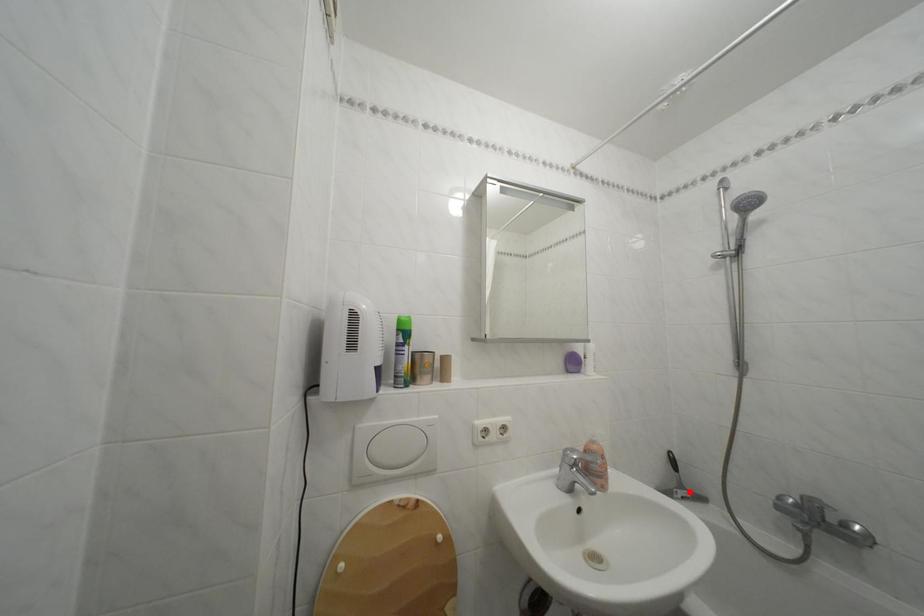
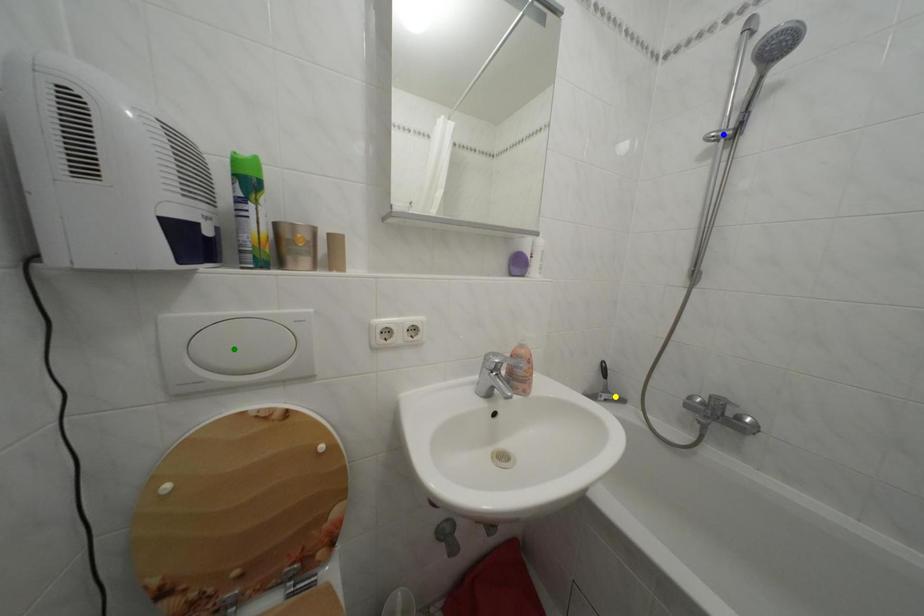
Question: I am providing you with two images of the same scene from different viewpoints. A red point is marked on the first image. You are given multiple points on the second image. Can you choose the point in image 2 that corresponds to the point in image 1?

Choices:
 (A) blue point
 (B) green point
 (C) yellow point

Answer: (C)